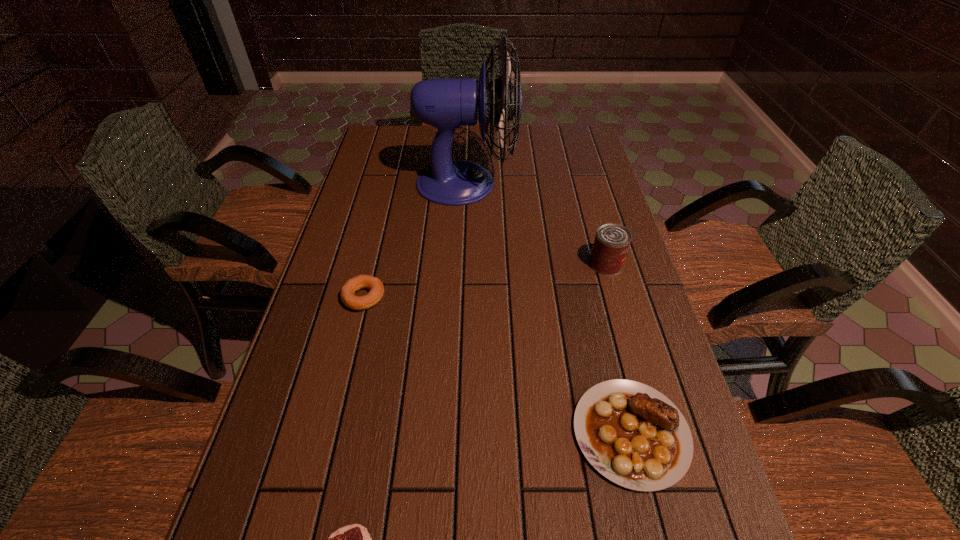
In the image, there is a desktop. Find the location of `blank space at the far right corner`. blank space at the far right corner is located at coordinates (586, 145).

In order to click on vacant point located between the second shortest object and the can in this screenshot , I will do `click(485, 281)`.

I want to click on vacant point located between the bagel and the farther steak, so click(497, 365).

Where is `blank region between the tallest object and the third nearest object`? Image resolution: width=960 pixels, height=540 pixels. blank region between the tallest object and the third nearest object is located at coordinates (415, 240).

What are the coordinates of `free space between the fourth shortest object and the third tallest object` in the screenshot? It's located at (618, 349).

This screenshot has height=540, width=960. I want to click on unoccupied position between the taller steak and the bagel, so pos(497,365).

Find the location of a particular element. This screenshot has width=960, height=540. object that stands as the fourth closest to the farthest object is located at coordinates (355, 539).

The height and width of the screenshot is (540, 960). Identify the location of object identified as the closest to the second shortest object. (447, 103).

This screenshot has width=960, height=540. In order to click on vacant space that satisfies the following two spatial constraints: 1. in front of the farthest object where the airflow is directed; 2. on the back side of the second farthest object in this screenshot , I will do `click(463, 264)`.

I want to click on free space that satisfies the following two spatial constraints: 1. in front of the tallest object where the airflow is directed; 2. on the right side of the can, so click(463, 264).